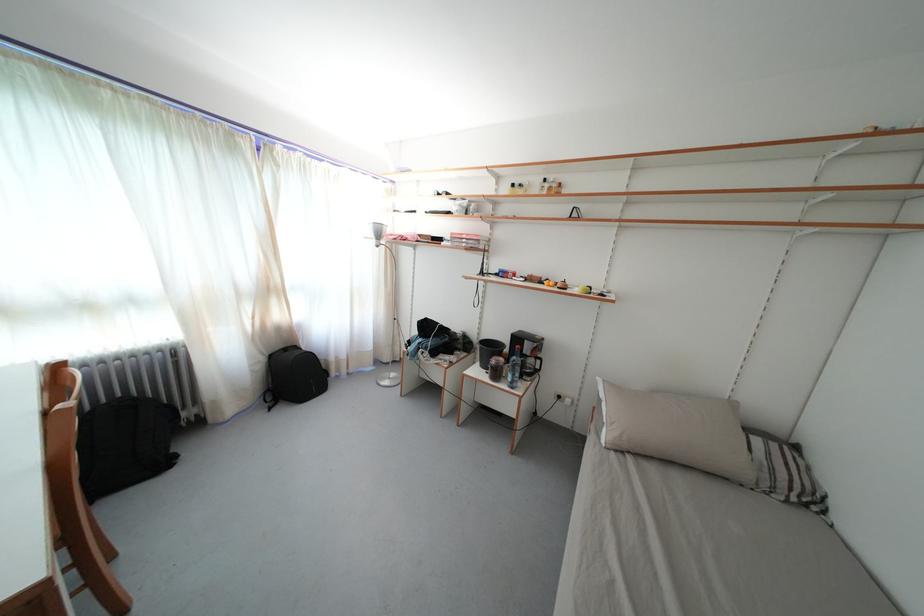
Identify the location of coffee maker carafe. The image size is (924, 616). (x=527, y=352).